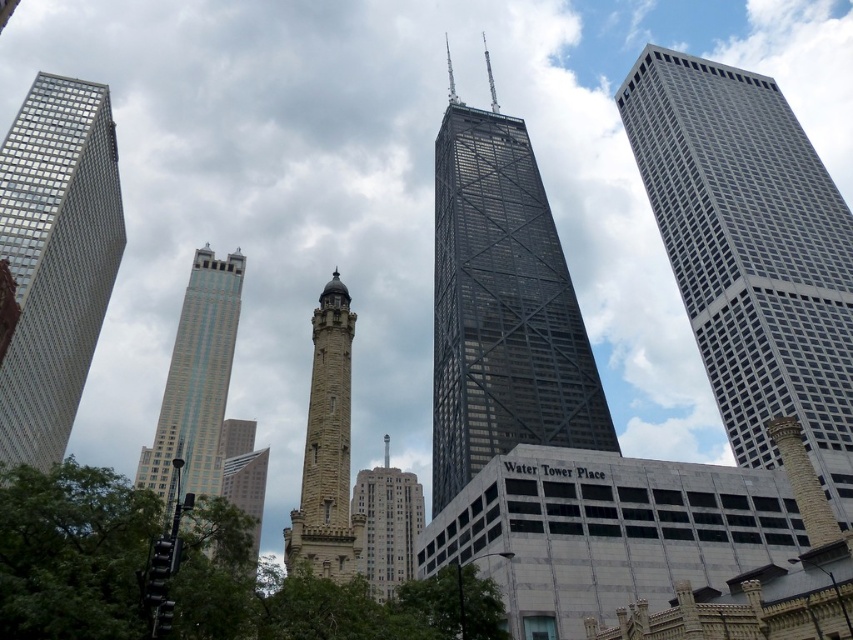
Question: Is black glass skyscraper at center positioned before glassy steel skyscraper at lower left?

Choices:
 (A) no
 (B) yes

Answer: (A)

Question: Estimate the real-world distances between objects in this image. Which object is farther from the glassy steel skyscraper at lower left?

Choices:
 (A) stone tower at center
 (B) matte glass skyscraper at left

Answer: (B)

Question: In this image, where is metallic grid skyscraper at right located relative to stone bell tower at center?

Choices:
 (A) right
 (B) left

Answer: (A)

Question: Considering the relative positions of black glass skyscraper at center and matte glass skyscraper at left in the image provided, where is black glass skyscraper at center located with respect to matte glass skyscraper at left?

Choices:
 (A) right
 (B) left

Answer: (A)

Question: Among these points, which one is farthest from the camera?

Choices:
 (A) (242, 468)
 (B) (842, 486)
 (C) (310, 394)
 (D) (177, 337)

Answer: (A)

Question: Which point appears farthest from the camera in this image?

Choices:
 (A) (178, 404)
 (B) (111, 176)

Answer: (A)